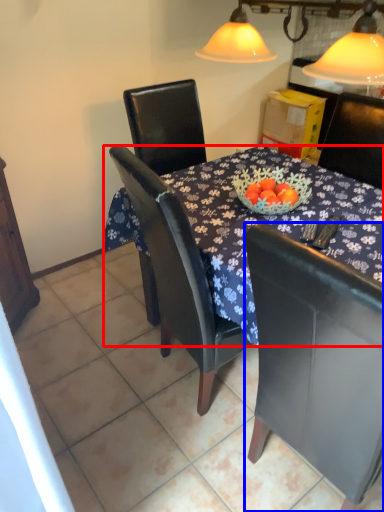
Question: Which of the following is the farthest to the observer, desk (highlighted by a red box) or chair (highlighted by a blue box)?

Choices:
 (A) desk
 (B) chair

Answer: (A)